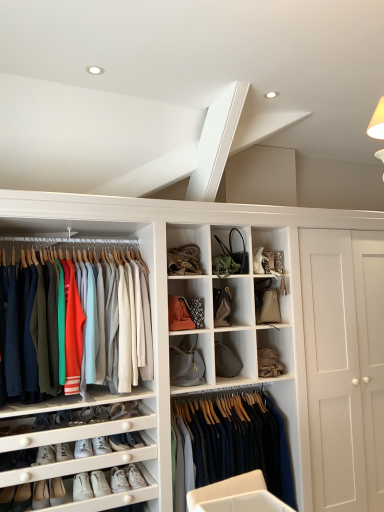
Question: Would you say white leather sneakers at lower left, which is the 4th footwear in right-to-left order, is part of matte gray fabric handbag at center, arranged as the 2th cabinet when ordered from the bottom,'s contents?

Choices:
 (A) no
 (B) yes

Answer: (A)

Question: Is matte gray fabric handbag at center, which is the third cabinet from top to bottom, to the left of white leather sneakers at lower left, which is counted as the third footwear, starting from the left, from the viewer's perspective?

Choices:
 (A) no
 (B) yes

Answer: (A)

Question: Is matte gray fabric handbag at center, which is the third cabinet from top to bottom, completely or partially outside of white leather sneakers at lower left, which is counted as the third footwear, starting from the left?

Choices:
 (A) no
 (B) yes

Answer: (B)

Question: Is matte gray fabric handbag at center, which is the third cabinet from top to bottom, oriented towards white leather sneakers at lower left, which is the 4th footwear in right-to-left order?

Choices:
 (A) yes
 (B) no

Answer: (B)

Question: Does matte gray fabric handbag at center, arranged as the 2th cabinet when ordered from the bottom, have a lesser height compared to white leather sneakers at lower left, which is the 4th footwear in right-to-left order?

Choices:
 (A) yes
 (B) no

Answer: (B)

Question: In terms of size, does matte gray fabric handbag at center, which is the third cabinet from top to bottom, appear bigger or smaller than matte black handbag at upper center, which ranks as the first accessory in right-to-left order?

Choices:
 (A) big
 (B) small

Answer: (A)

Question: Looking at their shapes, would you say matte gray fabric handbag at center, arranged as the 2th cabinet when ordered from the bottom, is wider or thinner than matte black handbag at upper center, the 1th accessory viewed from the top?

Choices:
 (A) thin
 (B) wide

Answer: (A)

Question: Relative to matte black handbag at upper center, the 1th accessory viewed from the top, is matte gray fabric handbag at center, arranged as the 2th cabinet when ordered from the bottom, in front or behind?

Choices:
 (A) behind
 (B) front

Answer: (B)

Question: Considering the positions of point (215, 296) and point (241, 270), is point (215, 296) closer or farther from the camera than point (241, 270)?

Choices:
 (A) closer
 (B) farther

Answer: (A)

Question: From the image's perspective, is white leather sneakers at lower left, the 5th footwear viewed from the left, positioned above or below white leather sneakers at lower left, the first footwear positioned from the right?

Choices:
 (A) below
 (B) above

Answer: (A)

Question: In terms of width, does white leather sneakers at lower left, positioned as the 2th footwear in right-to-left order, look wider or thinner when compared to white leather sneakers at lower left, the first footwear positioned from the right?

Choices:
 (A) wide
 (B) thin

Answer: (A)

Question: Would you say white leather sneakers at lower left, positioned as the 2th footwear in right-to-left order, is inside or outside white leather sneakers at lower left, positioned as the sixth footwear in left-to-right order?

Choices:
 (A) inside
 (B) outside

Answer: (B)

Question: Considering the positions of white leather sneakers at lower left, the 5th footwear viewed from the left, and white leather sneakers at lower left, the first footwear positioned from the right, in the image, is white leather sneakers at lower left, the 5th footwear viewed from the left, bigger or smaller than white leather sneakers at lower left, the first footwear positioned from the right,?

Choices:
 (A) small
 (B) big

Answer: (B)

Question: Is white leather shoe at lower left, placed as the 1th shoe when sorted from top to bottom, taller or shorter than knit sweater at left, which is the second clothing in right-to-left order?

Choices:
 (A) short
 (B) tall

Answer: (A)

Question: Would you say white leather shoe at lower left, the 2th shoe in the bottom-to-top sequence, is to the left or to the right of knit sweater at left, which is the second clothing in right-to-left order, in the picture?

Choices:
 (A) left
 (B) right

Answer: (B)